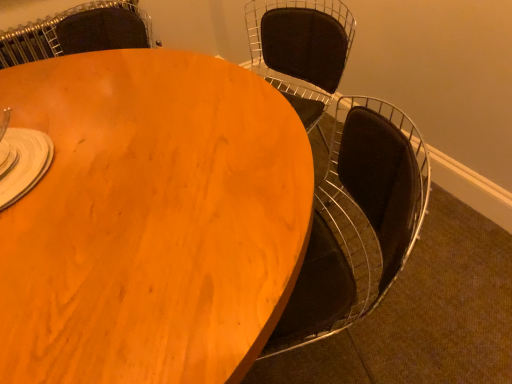
Question: Is matte wood chair at upper center, the first chair positioned from the left, far from matte black chair at upper right, positioned as the 2th chair in left-to-right order?

Choices:
 (A) yes
 (B) no

Answer: (B)

Question: Considering the relative sizes of matte wood chair at upper center, the first chair positioned from the left, and matte black chair at upper right, which is the 1th chair from right to left, in the image provided, is matte wood chair at upper center, the first chair positioned from the left, taller than matte black chair at upper right, which is the 1th chair from right to left,?

Choices:
 (A) yes
 (B) no

Answer: (B)

Question: Considering the relative positions of matte wood chair at upper center, the second chair from the right, and matte black chair at upper right, positioned as the 2th chair in left-to-right order, in the image provided, is matte wood chair at upper center, the second chair from the right, to the right of matte black chair at upper right, positioned as the 2th chair in left-to-right order, from the viewer's perspective?

Choices:
 (A) yes
 (B) no

Answer: (B)

Question: Is matte wood chair at upper center, the first chair positioned from the left, outside matte black chair at upper right, which is the 1th chair from right to left?

Choices:
 (A) yes
 (B) no

Answer: (A)

Question: From the image's perspective, does matte wood chair at upper center, the first chair positioned from the left, appear higher than matte black chair at upper right, which is the 1th chair from right to left?

Choices:
 (A) yes
 (B) no

Answer: (A)

Question: Is matte wood chair at upper center, the first chair positioned from the left, facing away from matte black chair at upper right, which is the 1th chair from right to left?

Choices:
 (A) yes
 (B) no

Answer: (B)

Question: Can you confirm if matte black chair at upper right, positioned as the 2th chair in left-to-right order, is positioned to the left of matte wood table at center?

Choices:
 (A) yes
 (B) no

Answer: (B)

Question: Does matte black chair at upper right, positioned as the 2th chair in left-to-right order, have a lesser width compared to matte wood table at center?

Choices:
 (A) no
 (B) yes

Answer: (B)

Question: Is the surface of matte black chair at upper right, which is the 1th chair from right to left, in direct contact with matte wood table at center?

Choices:
 (A) no
 (B) yes

Answer: (A)

Question: Is matte black chair at upper right, positioned as the 2th chair in left-to-right order, not within matte wood table at center?

Choices:
 (A) no
 (B) yes

Answer: (B)

Question: Does matte black chair at upper right, which is the 1th chair from right to left, have a greater width compared to matte wood table at center?

Choices:
 (A) yes
 (B) no

Answer: (B)

Question: Considering the relative sizes of matte black chair at upper right, which is the 1th chair from right to left, and matte wood table at center in the image provided, is matte black chair at upper right, which is the 1th chair from right to left, bigger than matte wood table at center?

Choices:
 (A) no
 (B) yes

Answer: (A)

Question: Considering the relative positions of matte wood table at center and matte wood chair at upper center, the first chair positioned from the left, in the image provided, is matte wood table at center behind matte wood chair at upper center, the first chair positioned from the left,?

Choices:
 (A) yes
 (B) no

Answer: (B)